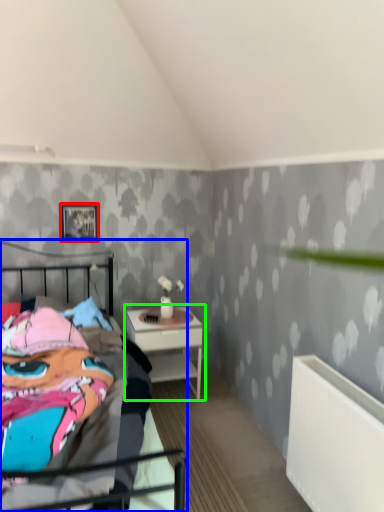
Question: Which is farther away from picture frame (highlighted by a red box)? bed (highlighted by a blue box) or nightstand (highlighted by a green box)?

Choices:
 (A) bed
 (B) nightstand

Answer: (A)